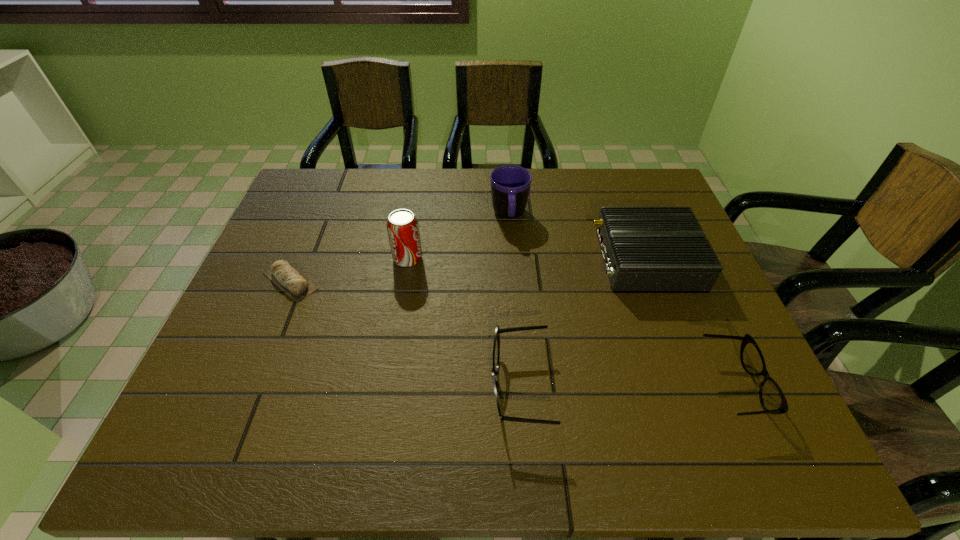
This screenshot has height=540, width=960. I want to click on free point located on the front-facing side of the fourth tallest object, so click(448, 387).

Image resolution: width=960 pixels, height=540 pixels. In order to click on vacant space located 0.260m on the front-facing side of the fourth tallest object in this screenshot , I will do `click(369, 387)`.

This screenshot has height=540, width=960. I want to click on free spot located 0.140m with the handle on the side of the second tallest object, so click(514, 268).

You are a GUI agent. You are given a task and a screenshot of the screen. Output one action in this format:
    pyautogui.click(x=<x>, y=<y>)
    Task: Click on the vacant space positioned 0.160m on the back panel of the router
    Image resolution: width=960 pixels, height=540 pixels.
    Given the screenshot: What is the action you would take?
    click(538, 260)

Locate an element on the screen. The height and width of the screenshot is (540, 960). vacant space located 0.330m on the back panel of the router is located at coordinates (475, 260).

Where is `free space located 0.150m on the back panel of the router`? free space located 0.150m on the back panel of the router is located at coordinates (541, 260).

You are a GUI agent. You are given a task and a screenshot of the screen. Output one action in this format:
    pyautogui.click(x=<x>, y=<y>)
    Task: Click on the vacant space located 0.260m on the right of the leftmost object
    
    Given the screenshot: What is the action you would take?
    pyautogui.click(x=421, y=281)

Image resolution: width=960 pixels, height=540 pixels. Identify the location of free space located on the front of the soda can. (388, 377).

In order to click on object that is at the far edge in this screenshot , I will do `click(510, 185)`.

The height and width of the screenshot is (540, 960). I want to click on object that is at the left edge, so click(x=285, y=276).